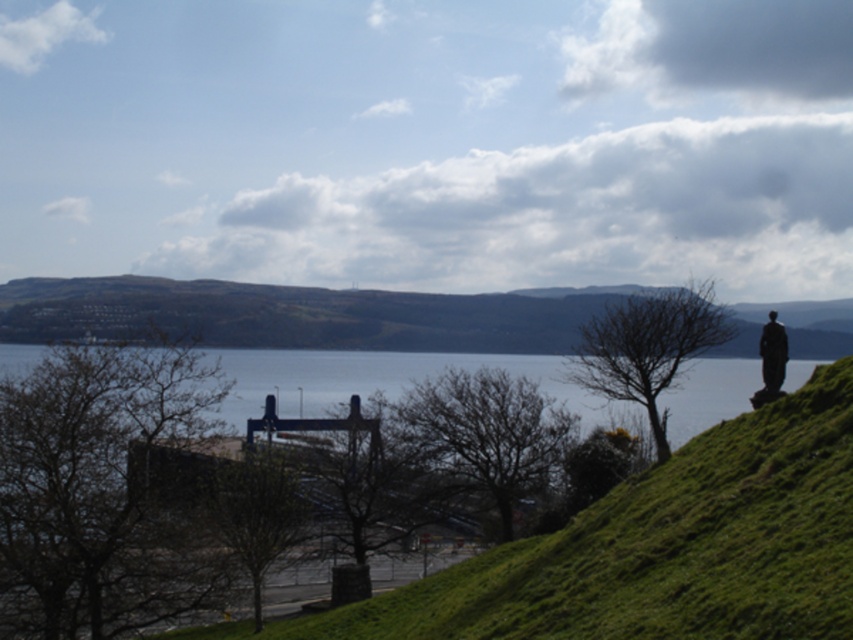
How distant is bare branches at center from green leafy tree at center?

The distance of bare branches at center from green leafy tree at center is 11.61 meters.

In the scene shown: Does bare branches at center have a larger size compared to green leafy tree at center?

Actually, bare branches at center might be smaller than green leafy tree at center.

Does point (479, 484) come closer to viewer compared to point (262, 467)?

No, it is behind (262, 467).

The height and width of the screenshot is (640, 853). I want to click on bare branches at center, so click(486, 435).

Is bare wood tree at center shorter than green leafy tree at center?

Yes, bare wood tree at center is shorter than green leafy tree at center.

Who is shorter, bare wood tree at center or green leafy tree at center?

bare wood tree at center

Which is in front, point (650, 419) or point (262, 554)?

Point (262, 554) is in front.

Identify the location of bare wood tree at center. The width and height of the screenshot is (853, 640). [648, 346].

Is point (38, 579) closer to camera compared to point (215, 465)?

Yes, it is.

Is point (184, 529) positioned behind point (219, 515)?

No, (184, 529) is in front of (219, 515).

Where is `brown leafless tree at left`? brown leafless tree at left is located at coordinates (102, 493).